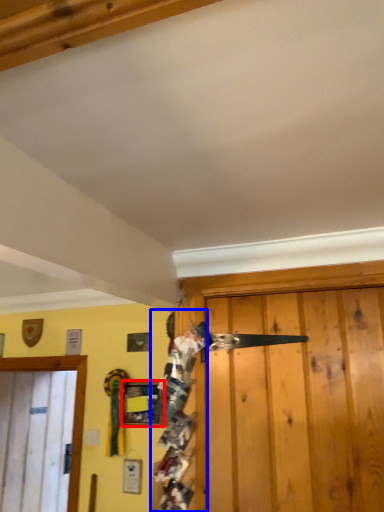
Question: Which of the following is the farthest to the observer, picture frame (highlighted by a red box) or person (highlighted by a blue box)?

Choices:
 (A) picture frame
 (B) person

Answer: (A)